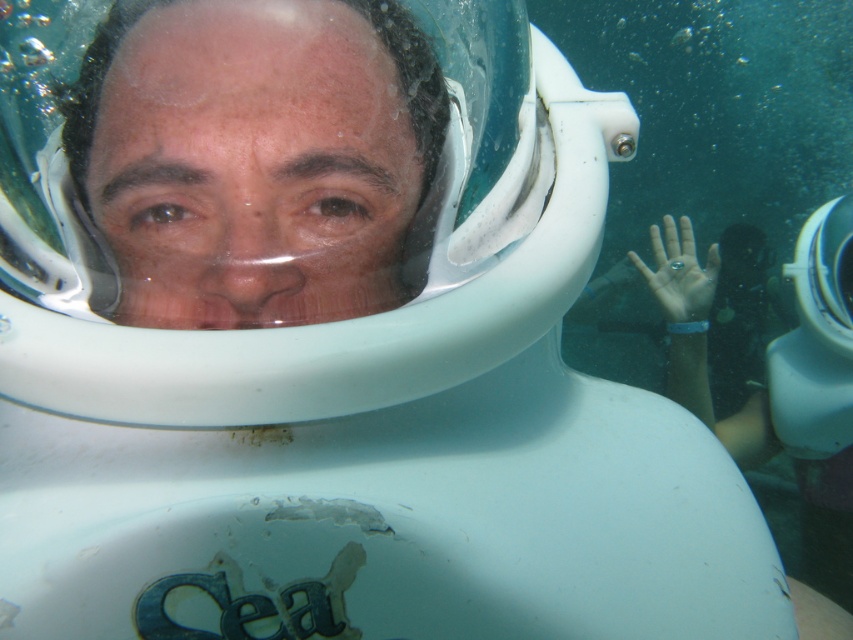
What is located at the coordinates point (254, 157)?

The matte plastic face at center is located at point (254, 157).

You are an underwater photographer aiming to capture the matte plastic face at center and the clear plastic ring at center in a single frame. Based on their sizes, which object should you focus on first to ensure both are in focus?

The matte plastic face at center has a lesser height compared to the clear plastic ring at center, so you should focus on the larger object, the clear plastic ring at center, first to ensure both are in focus.

You are an underwater photographer capturing the scene. You notice the matte plastic face at center and the clear plastic ring at center. Which object is located to the left of the other?

The matte plastic face at center is positioned on the left side of clear plastic ring at center.